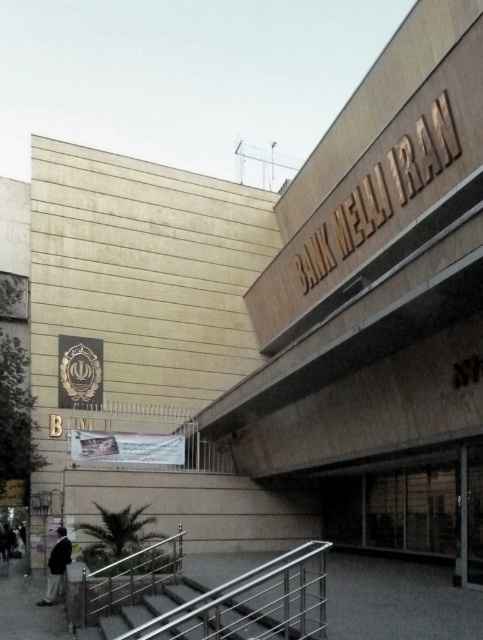
Between point (474, 547) and point (65, 532), which one is positioned behind?

Point (65, 532)

Can you confirm if glass door at center is positioned below dark gray suit at lower left?

Actually, glass door at center is above dark gray suit at lower left.

Who is more distant from viewer, (462, 564) or (60, 528)?

Point (60, 528)

Image resolution: width=483 pixels, height=640 pixels. What are the coordinates of `glass door at center` in the screenshot? It's located at (470, 515).

Is stainless steel stairs at center behind glass door at center?

No, it is not.

Is point (226, 620) positioned after point (472, 515)?

No.

Locate an element on the screen. This screenshot has height=640, width=483. stainless steel stairs at center is located at coordinates (227, 611).

Looking at this image, measure the distance between stainless steel stairs at center and camera.

They are 5.98 meters apart.

Does stainless steel stairs at center appear on the right side of dark gray suit at lower left?

Correct, you'll find stainless steel stairs at center to the right of dark gray suit at lower left.

What do you see at coordinates (227, 611) in the screenshot?
I see `stainless steel stairs at center` at bounding box center [227, 611].

Locate an element on the screen. The image size is (483, 640). stainless steel stairs at center is located at coordinates (227, 611).